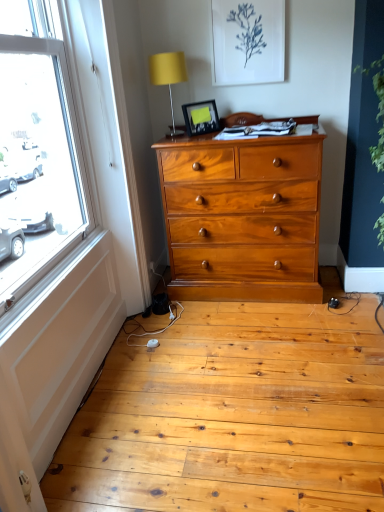
Question: Would you say matte black picture frame at upper center is inside or outside matte yellow fabric at upper center?

Choices:
 (A) inside
 (B) outside

Answer: (B)

Question: Is matte black picture frame at upper center wider or thinner than matte yellow fabric at upper center?

Choices:
 (A) wide
 (B) thin

Answer: (B)

Question: Estimate the real-world distances between objects in this image. Which object is farther from the matte black picture frame at upper center?

Choices:
 (A) green leafy plant at right
 (B) matte yellow fabric at upper center

Answer: (A)

Question: Which object is positioned closest to the green leafy plant at right?

Choices:
 (A) matte yellow fabric at upper center
 (B) matte black picture frame at upper center

Answer: (B)